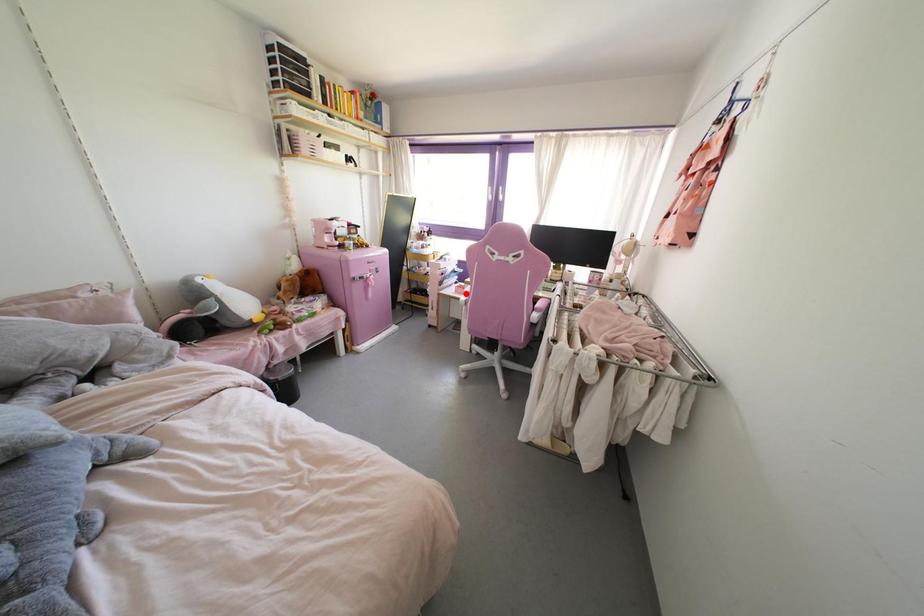
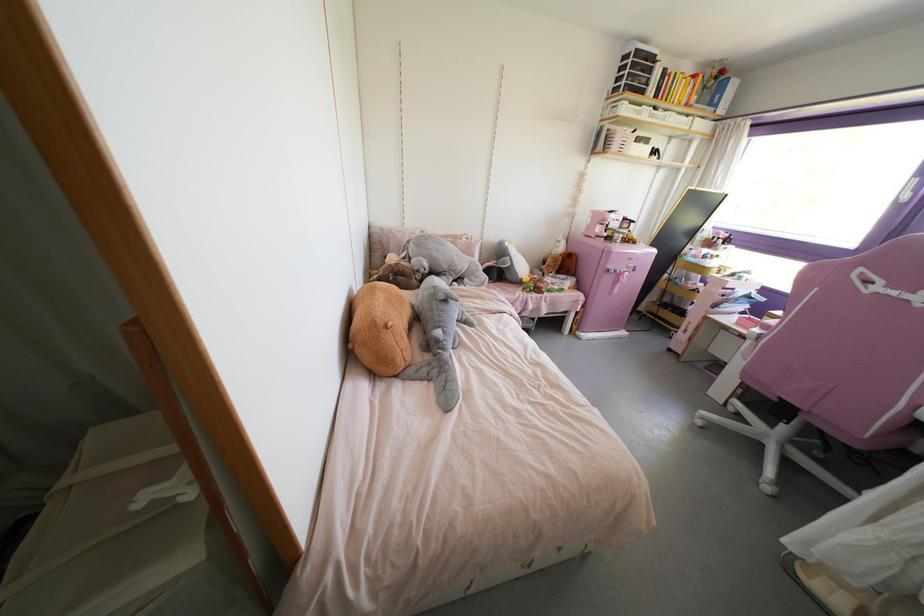
Find the pixel in the second image that matches the highlighted location in the first image.

(764, 326)